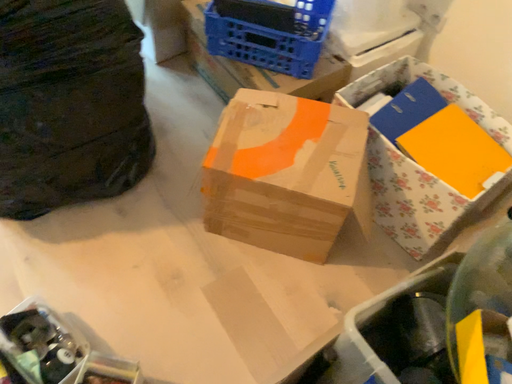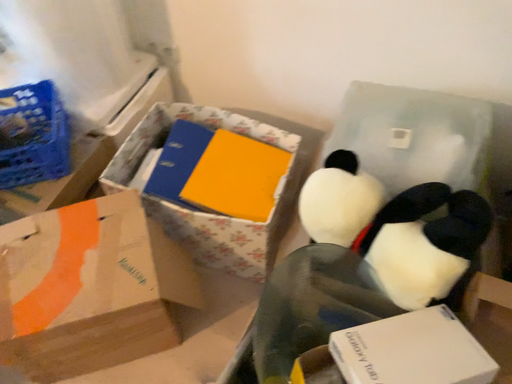
Question: How did the camera likely rotate when shooting the video?

Choices:
 (A) rotated left
 (B) rotated right

Answer: (B)